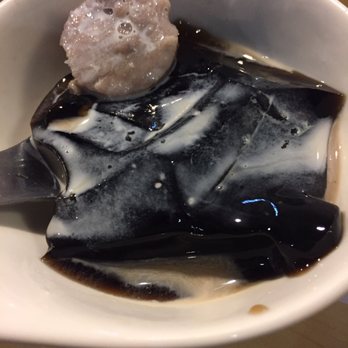
The image size is (348, 348). In order to click on rim of white bowl in this screenshot , I will do `click(261, 334)`.